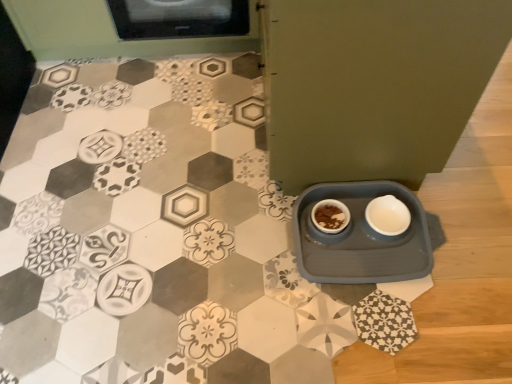
Question: Is white matte bowl at lower right shorter than brown matte bowl at center?

Choices:
 (A) yes
 (B) no

Answer: (B)

Question: Is white matte bowl at lower right further to the viewer compared to brown matte bowl at center?

Choices:
 (A) yes
 (B) no

Answer: (B)

Question: Is white matte bowl at lower right far from brown matte bowl at center?

Choices:
 (A) yes
 (B) no

Answer: (B)

Question: Is white matte bowl at lower right facing away from brown matte bowl at center?

Choices:
 (A) yes
 (B) no

Answer: (B)

Question: Can you confirm if white matte bowl at lower right is thinner than brown matte bowl at center?

Choices:
 (A) yes
 (B) no

Answer: (B)

Question: In terms of size, does brown matte bowl at center appear bigger or smaller than gray plastic tray at lower right?

Choices:
 (A) big
 (B) small

Answer: (B)

Question: Would you say brown matte bowl at center is to the left or to the right of gray plastic tray at lower right in the picture?

Choices:
 (A) right
 (B) left

Answer: (B)

Question: From a real-world perspective, relative to gray plastic tray at lower right, is brown matte bowl at center vertically above or below?

Choices:
 (A) above
 (B) below

Answer: (A)

Question: Do you think brown matte bowl at center is within gray plastic tray at lower right, or outside of it?

Choices:
 (A) inside
 (B) outside

Answer: (A)

Question: From the image's perspective, is gray plastic tray at lower right positioned above or below white matte bowl at lower right?

Choices:
 (A) above
 (B) below

Answer: (B)

Question: Is gray plastic tray at lower right taller or shorter than white matte bowl at lower right?

Choices:
 (A) short
 (B) tall

Answer: (B)

Question: Is gray plastic tray at lower right in front of or behind white matte bowl at lower right in the image?

Choices:
 (A) front
 (B) behind

Answer: (A)

Question: Considering the positions of gray plastic tray at lower right and white matte bowl at lower right in the image, is gray plastic tray at lower right wider or thinner than white matte bowl at lower right?

Choices:
 (A) thin
 (B) wide

Answer: (B)

Question: Considering the positions of gray plastic tray at lower right and brown matte bowl at center in the image, is gray plastic tray at lower right wider or thinner than brown matte bowl at center?

Choices:
 (A) thin
 (B) wide

Answer: (B)

Question: Considering their positions, is gray plastic tray at lower right located in front of or behind brown matte bowl at center?

Choices:
 (A) front
 (B) behind

Answer: (A)